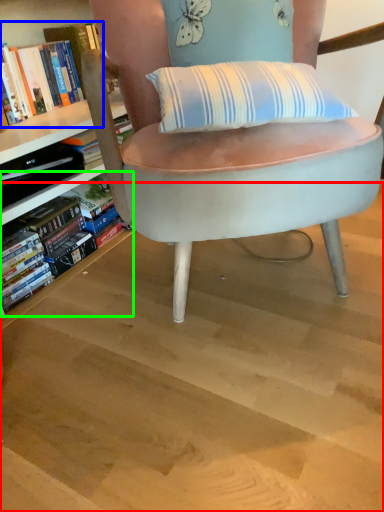
Question: Which object is the farthest from stairwell (highlighted by a red box)? Choose among these: book (highlighted by a blue box) or book (highlighted by a green box).

Choices:
 (A) book
 (B) book

Answer: (A)